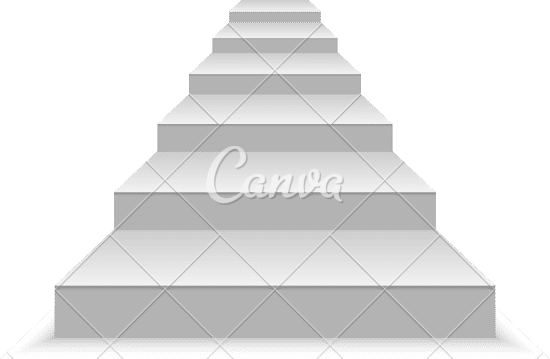
You are a GUI agent. You are given a task and a screenshot of the screen. Output one action in this format:
    pyautogui.click(x=<x>, y=<y>)
    Task: Click on the stair
    The image size is (550, 359).
    Given the screenshot: What is the action you would take?
    pyautogui.click(x=103, y=306), pyautogui.click(x=170, y=203), pyautogui.click(x=226, y=138), pyautogui.click(x=300, y=81), pyautogui.click(x=317, y=44), pyautogui.click(x=296, y=14)